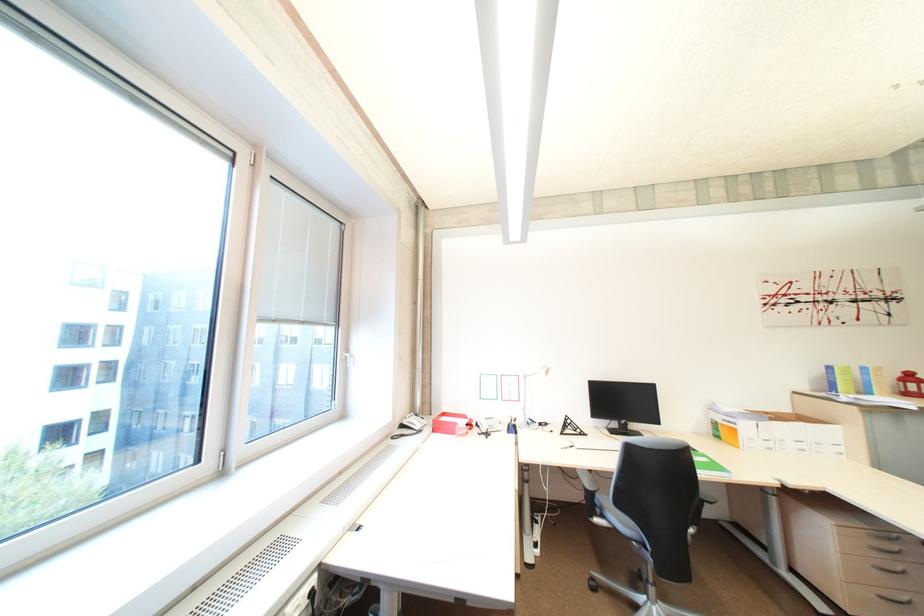
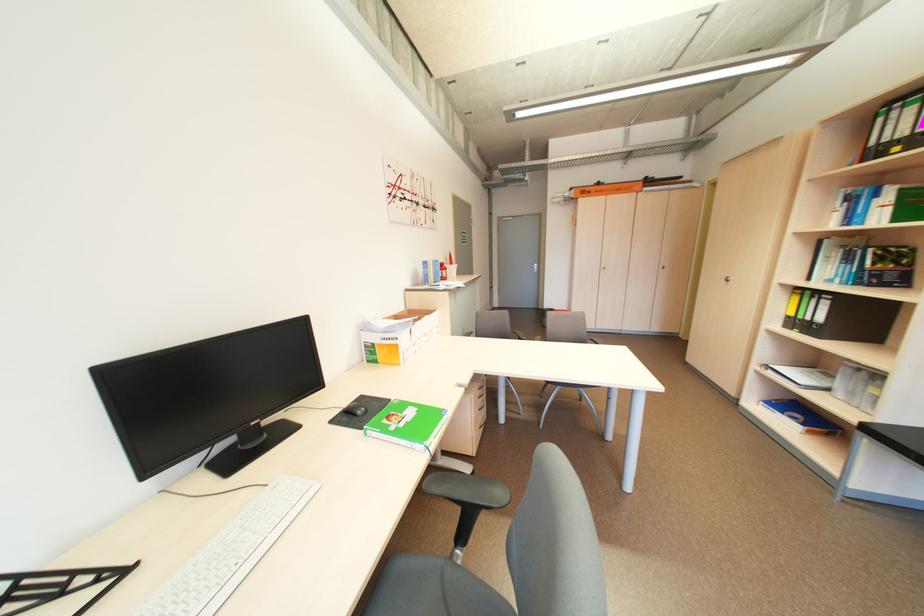
The point at [588,431] is marked in the first image. Where is the corresponding point in the second image?

(91, 582)